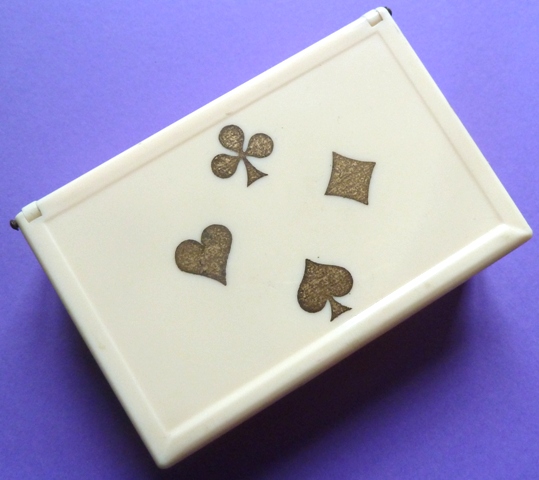
Where is `hinges`? The width and height of the screenshot is (539, 480). hinges is located at coordinates (34, 209), (371, 27).